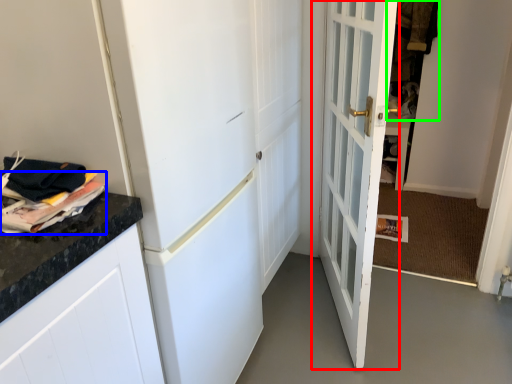
Question: Which object is positioned closest to door (highlighted by a red box)? Select from magazine (highlighted by a blue box) and laundry (highlighted by a green box).

Choices:
 (A) magazine
 (B) laundry

Answer: (A)